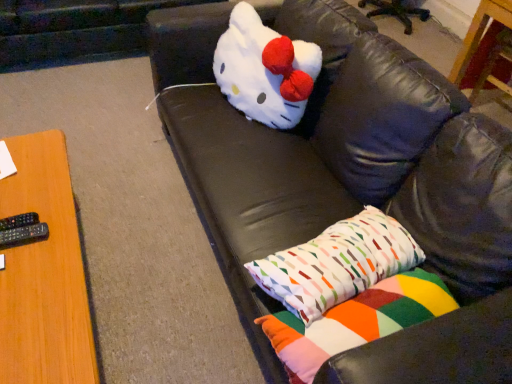
Locate an element on the screen. free point behind black plastic remote at left, which is counted as the first remote, starting from the top is located at coordinates (29, 193).